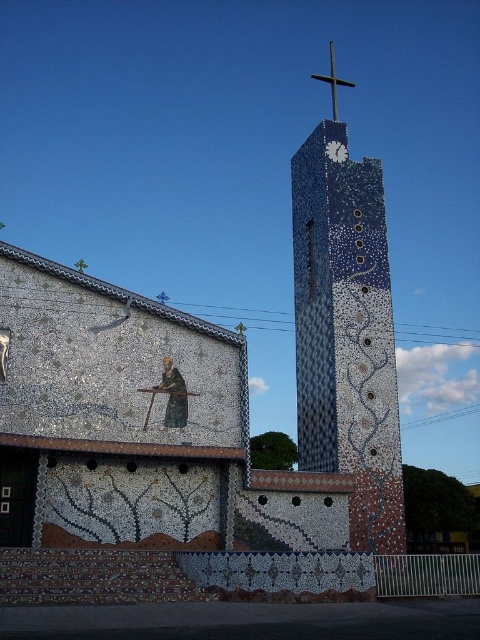
Question: Can you confirm if blue mosaic tower at center is wider than white mosaic clock at upper center?

Choices:
 (A) yes
 (B) no

Answer: (A)

Question: Observing the image, what is the correct spatial positioning of blue mosaic tower at center in reference to white mosaic clock at upper center?

Choices:
 (A) below
 (B) above

Answer: (A)

Question: Is blue mosaic tower at center wider than metallic cross at upper center?

Choices:
 (A) yes
 (B) no

Answer: (A)

Question: Which object is farther from the camera taking this photo?

Choices:
 (A) white mosaic clock at upper center
 (B) metallic cross at upper center

Answer: (B)

Question: Estimate the real-world distances between objects in this image. Which object is closer to the white mosaic clock at upper center?

Choices:
 (A) metallic cross at upper center
 (B) blue mosaic tower at center

Answer: (B)

Question: Among these objects, which one is nearest to the camera?

Choices:
 (A) white mosaic clock at upper center
 (B) metallic cross at upper center
 (C) blue mosaic tower at center

Answer: (C)